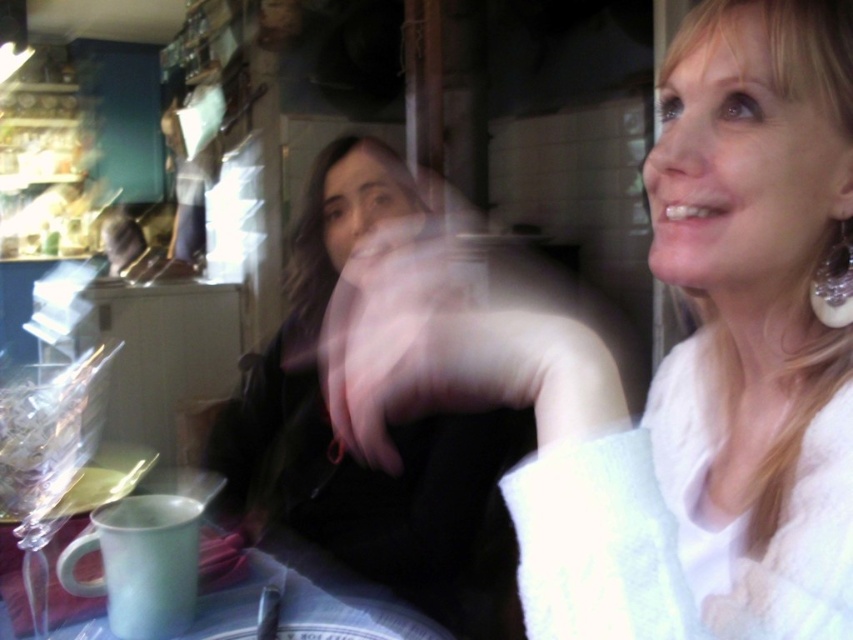
Who is shorter, white fuzzy sweater at upper right or smooth black hand at center?

white fuzzy sweater at upper right is shorter.

Is white fuzzy sweater at upper right wider than smooth black hand at center?

No.

Is point (534, 340) farther from camera compared to point (495, 481)?

No, it is not.

Where is `white fuzzy sweater at upper right`? This screenshot has height=640, width=853. white fuzzy sweater at upper right is located at coordinates (666, 362).

Does white fuzzy sweater at upper right appear over white fluffy robe at upper right?

Yes, white fuzzy sweater at upper right is above white fluffy robe at upper right.

Is white fuzzy sweater at upper right smaller than white fluffy robe at upper right?

Incorrect, white fuzzy sweater at upper right is not smaller in size than white fluffy robe at upper right.

Is point (740, 323) closer to viewer compared to point (541, 481)?

No, it is behind (541, 481).

The image size is (853, 640). I want to click on white fuzzy sweater at upper right, so click(666, 362).

Can you confirm if white fluffy robe at upper right is bigger than smooth black hand at center?

Incorrect, white fluffy robe at upper right is not larger than smooth black hand at center.

Measure the distance between white fluffy robe at upper right and camera.

white fluffy robe at upper right and camera are 15.83 inches apart from each other.

At what (x,y) coordinates should I click in order to perform the action: click on white fluffy robe at upper right. Please return your answer as a coordinate pair (x, y). The image size is (853, 640). Looking at the image, I should click on (682, 524).